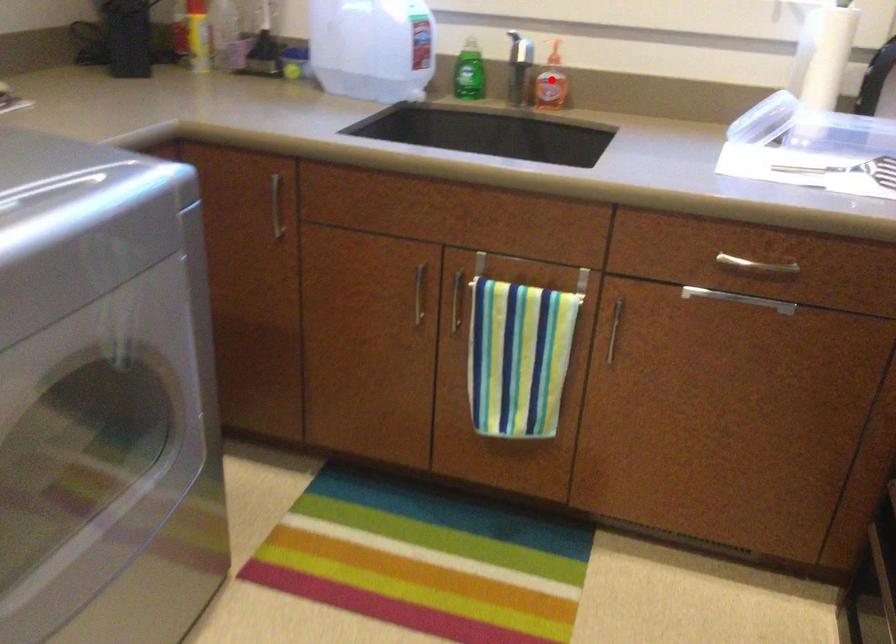
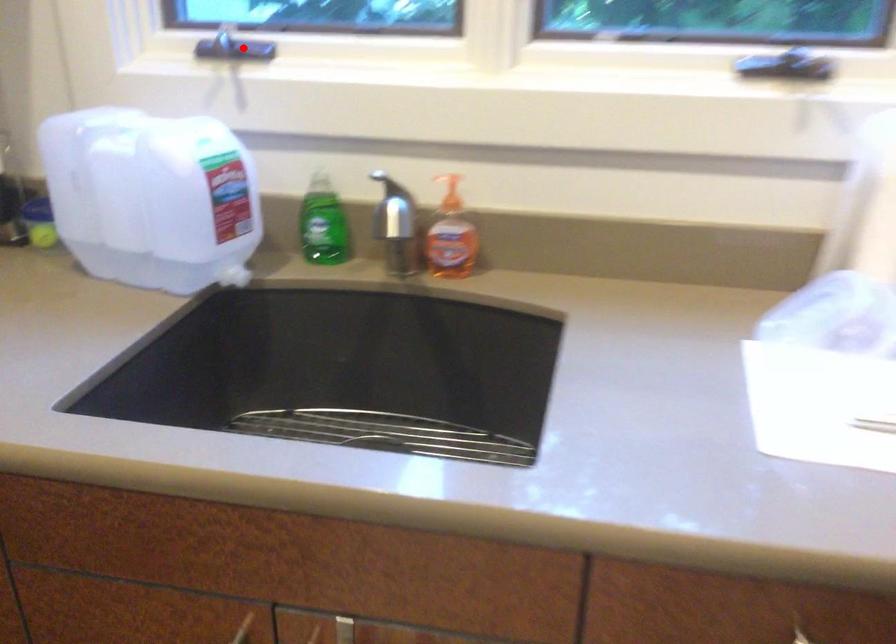
I am providing you with two images of the same scene from different viewpoints. A red point is marked on the first image and another point is marked on the second image. Is the marked point in image1 the same physical position as the marked point in image2?

No